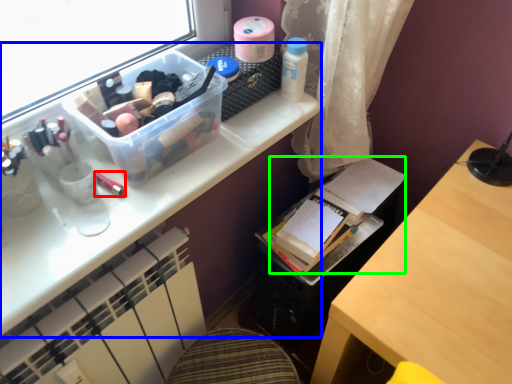
Question: Based on their relative distances, which object is nearer to toiletry (highlighted by a red box)? Choose from desk (highlighted by a blue box) and book (highlighted by a green box).

Choices:
 (A) desk
 (B) book

Answer: (A)